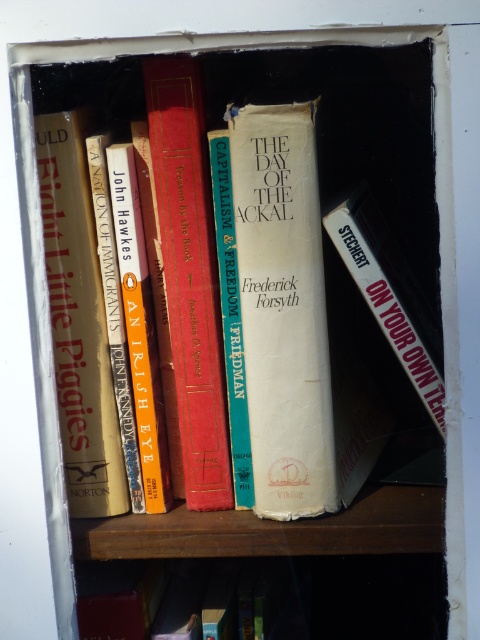
You are organizing a bookshelf and want to place both the hardcover book at center and the white matte book at right. Since you have limited space, which book should you place first to ensure both fit on the shelf?

The hardcover book at center should be placed first because it occupies less space than the white matte book at right, allowing both to fit on the shelf.

You are organizing a bookshelf and need to place a 25 centimeter wide book. There are two hardcover books on the shelf. Can you fit the new book between the hardcover book at center and the hardcover book at lower center?

The distance between the hardcover book at center and the hardcover book at lower center is 25.77 centimeters. Since the new book is 25 centimeters wide, it can fit in the space between them.

You are a librarian who needs to place a new book that is 40 centimeters wide. You see the hardcover book at lower center and the white matte book at right. Can you fit the new book between them?

The distance between the hardcover book at lower center and the white matte book at right is 39.31 centimeters. Since the new book is 40 centimeters wide, it cannot fit in the available space between them.